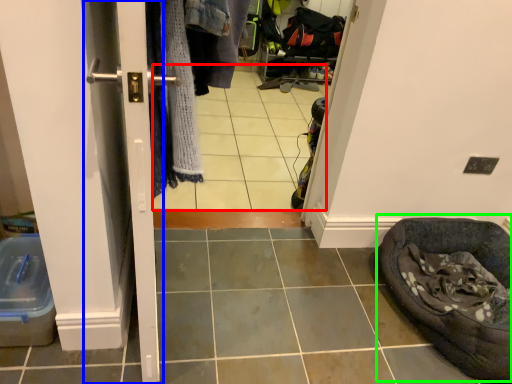
Question: Estimate the real-world distances between objects in this image. Which object is farther from tile (highlighted by a red box), screen door (highlighted by a blue box) or bean bag chair (highlighted by a green box)?

Choices:
 (A) screen door
 (B) bean bag chair

Answer: (A)